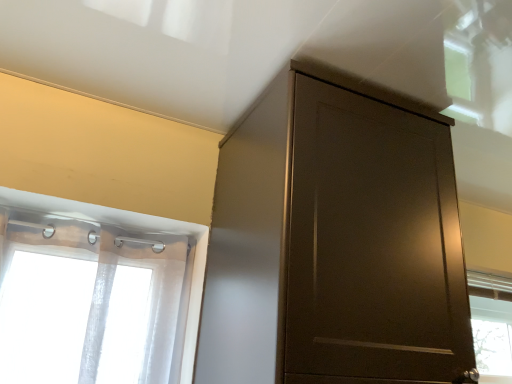
The height and width of the screenshot is (384, 512). What are the coordinates of `glossy dark brown cupboard at upper center` in the screenshot? It's located at (330, 238).

Describe the element at coordinates (330, 238) in the screenshot. This screenshot has height=384, width=512. I see `glossy dark brown cupboard at upper center` at that location.

Where is `glossy dark brown cupboard at upper center`? glossy dark brown cupboard at upper center is located at coordinates (330, 238).